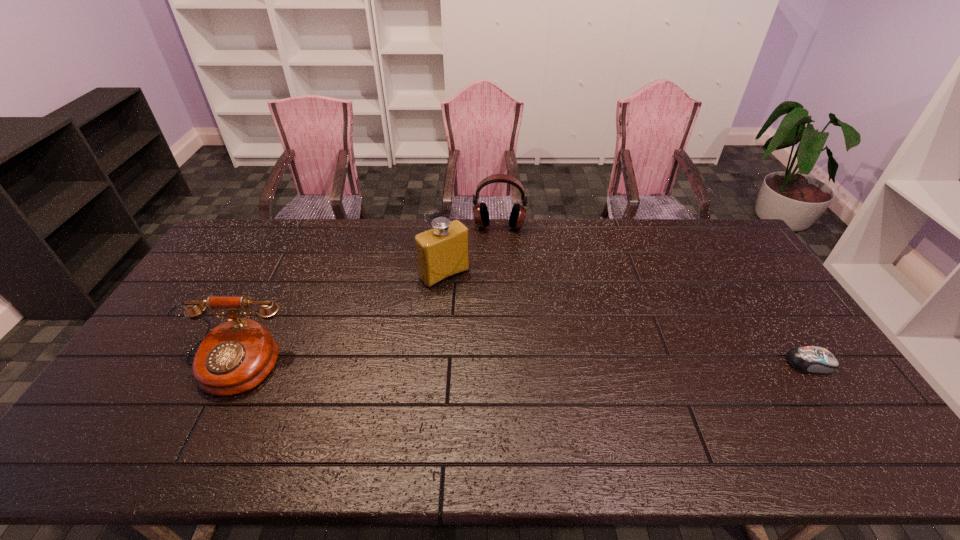
Find the location of a particular element. The image size is (960, 540). free space located 0.260m on the front-facing side of the tallest object is located at coordinates (507, 338).

Find the location of a particular element. free region located on the front-facing side of the tallest object is located at coordinates (507, 338).

Locate an element on the screen. This screenshot has width=960, height=540. vacant space located on the front-facing side of the tallest object is located at coordinates (533, 365).

Locate an element on the screen. object at the far edge is located at coordinates (480, 211).

At what (x,y) coordinates should I click in order to perform the action: click on object that is at the near edge. Please return your answer as a coordinate pair (x, y). The width and height of the screenshot is (960, 540). Looking at the image, I should click on (234, 357).

This screenshot has height=540, width=960. In order to click on object located at the left edge in this screenshot , I will do `click(234, 357)`.

This screenshot has height=540, width=960. I want to click on object that is at the right edge, so click(x=808, y=359).

Locate an element on the screen. object that is at the near left corner is located at coordinates 234,357.

Find the location of a particular element. The height and width of the screenshot is (540, 960). vacant region at the far edge of the desktop is located at coordinates (623, 238).

This screenshot has width=960, height=540. I want to click on vacant space at the near edge, so click(191, 390).